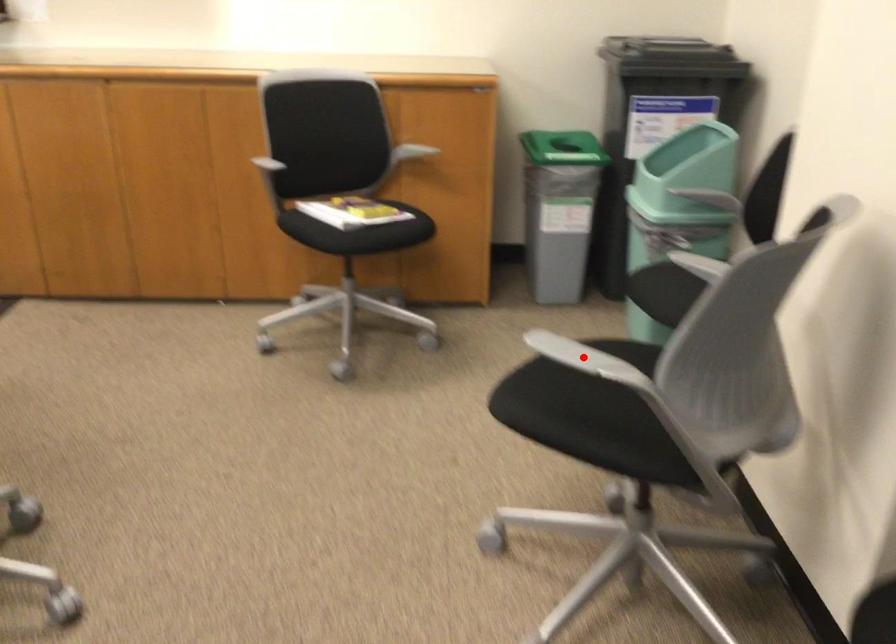
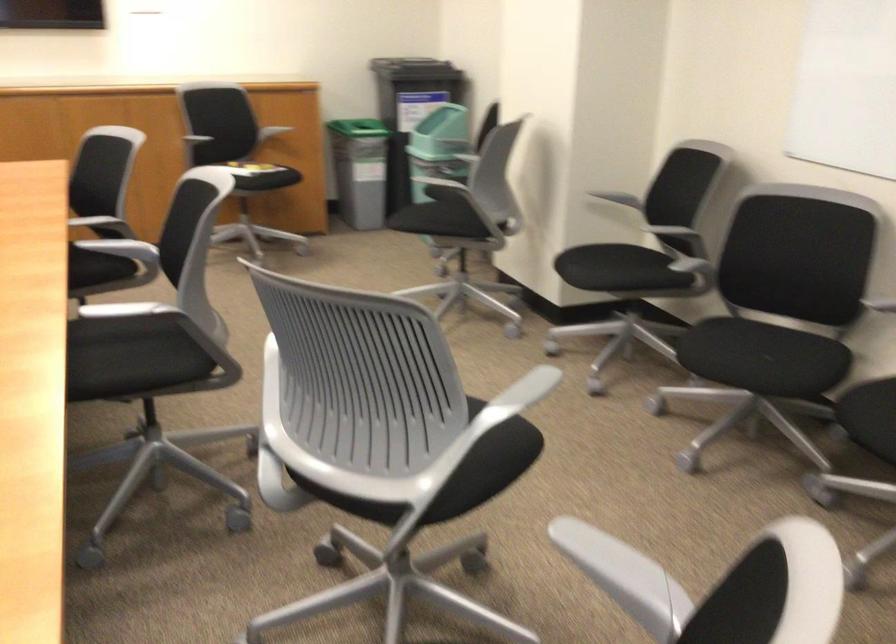
Question: I am providing you with two images of the same scene from different viewpoints. A red point is marked on the first image. Is the red point's position out of view in image 2?

Choices:
 (A) Yes
 (B) No

Answer: (A)